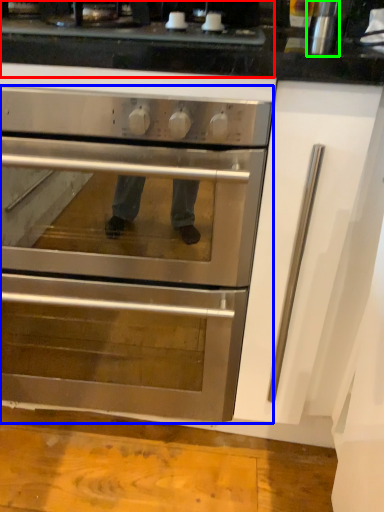
Question: Estimate the real-world distances between objects in this image. Which object is closer to gas stove (highlighted by a red box), oven (highlighted by a blue box) or appliance (highlighted by a green box)?

Choices:
 (A) oven
 (B) appliance

Answer: (B)